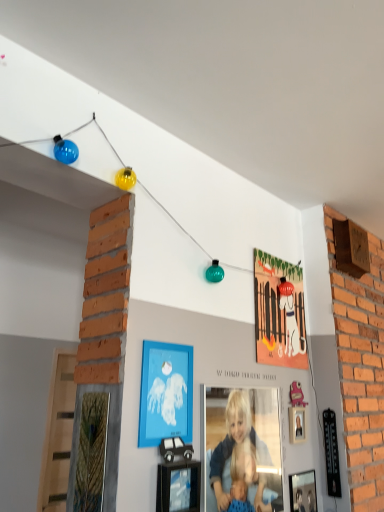
Question: From the image's perspective, relative to matte orange picture frame at upper center, the first picture frame positioned from the back, is blue matte picture frame at center, the 3th picture frame from the back, above or below?

Choices:
 (A) below
 (B) above

Answer: (A)

Question: Relative to matte orange picture frame at upper center, which is counted as the first picture frame, starting from the top, is blue matte picture frame at center, which ranks as the fourth picture frame in right-to-left order, in front or behind?

Choices:
 (A) behind
 (B) front

Answer: (B)

Question: Which object is the closest to the matte orange picture frame at upper center, arranged as the 2th picture frame when viewed from the right?

Choices:
 (A) blue matte picture frame at center, the 3th picture frame from the back
 (B) smooth blonde hair at center
 (C) black cardboard car at lower center, the second picture frame positioned from the bottom
 (D) metallic silver picture frame at lower right, which is the 4th picture frame in top-to-bottom order

Answer: (B)

Question: Which of these objects is positioned closest to the smooth blonde hair at center?

Choices:
 (A) blue matte picture frame at center, which appears as the third picture frame when ordered from the bottom
 (B) black cardboard car at lower center, the second picture frame positioned from the bottom
 (C) matte orange picture frame at upper center, which is counted as the first picture frame, starting from the top
 (D) metallic silver picture frame at lower right, which appears as the 1th picture frame when ordered from the bottom

Answer: (B)